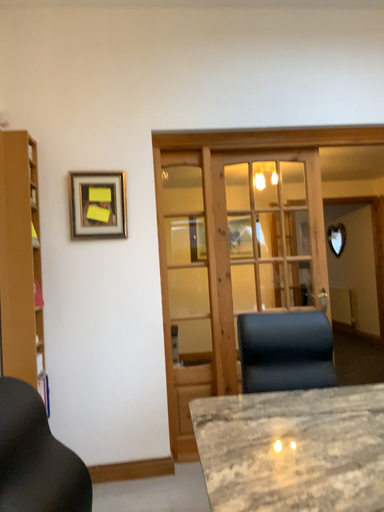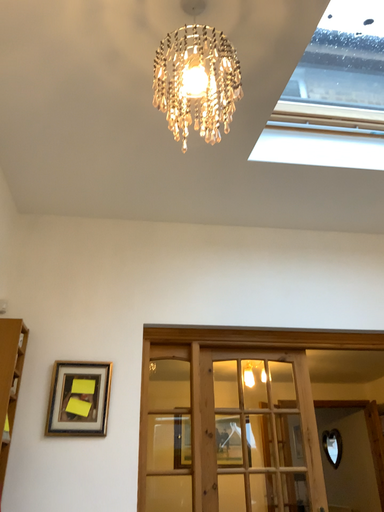
Question: How did the camera likely rotate when shooting the video?

Choices:
 (A) rotated downward
 (B) rotated upward

Answer: (B)